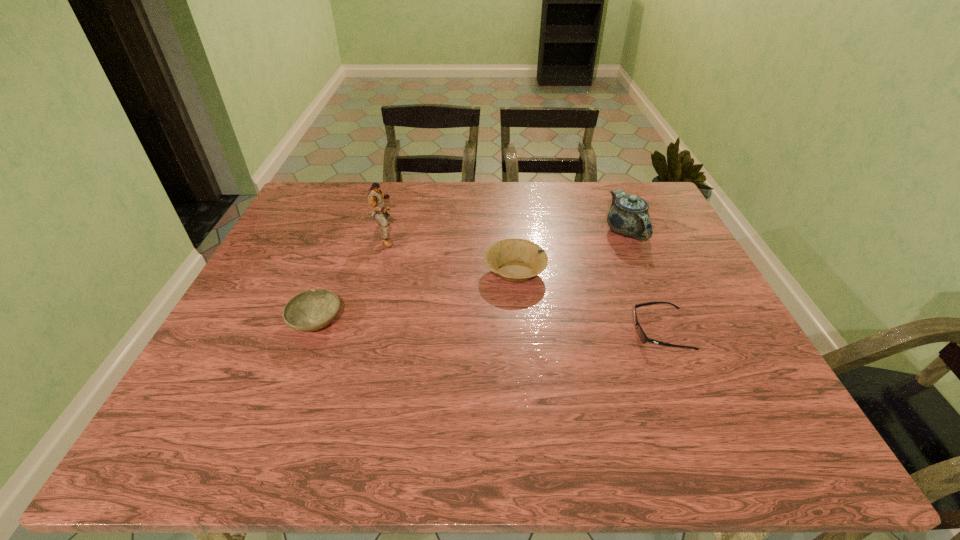
I want to click on vacant space positioned on the left of the third nearest object, so click(334, 272).

The width and height of the screenshot is (960, 540). I want to click on free space located on the right of the left bowl, so click(483, 322).

Identify the location of vacant space located on the front-facing side of the shortest object. (483, 332).

Find the location of a particular element. This screenshot has height=540, width=960. vacant area situated 0.170m on the front-facing side of the shortest object is located at coordinates (561, 332).

Locate an element on the screen. The width and height of the screenshot is (960, 540). vacant space located on the front-facing side of the shortest object is located at coordinates (587, 332).

Locate an element on the screen. object that is positioned at the far edge is located at coordinates (628, 216).

In order to click on object located at the left edge in this screenshot , I will do `click(311, 310)`.

At what (x,y) coordinates should I click in order to perform the action: click on chinaware positioned at the right edge. Please return your answer as a coordinate pair (x, y). The height and width of the screenshot is (540, 960). Looking at the image, I should click on (628, 216).

Where is `sunglasses that is positioned at the right edge`? This screenshot has height=540, width=960. sunglasses that is positioned at the right edge is located at coordinates (641, 333).

Where is `object situated at the far right corner`? This screenshot has height=540, width=960. object situated at the far right corner is located at coordinates (628, 216).